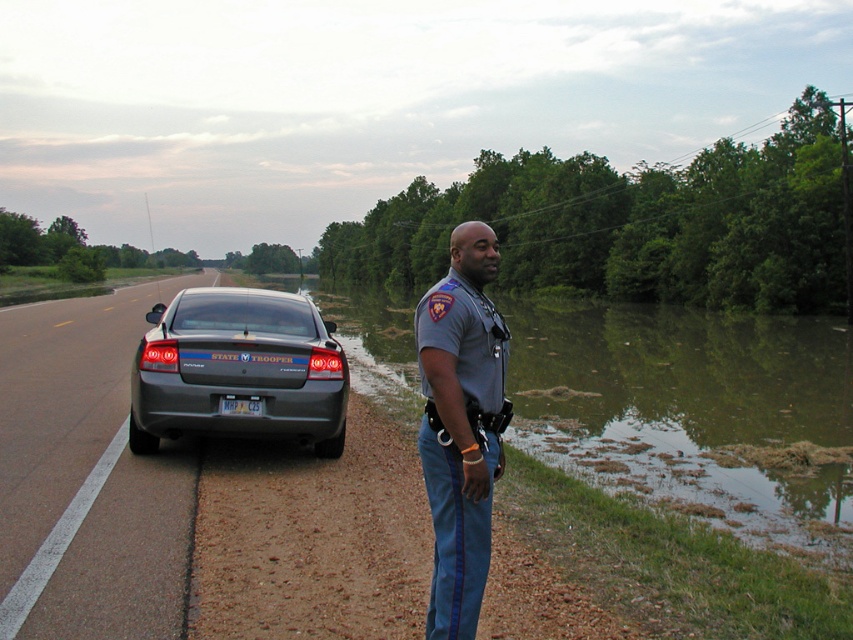
You are driving a car that is 2 meters wide and want to avoid the flooded area. The green muddy water at right is part of the flooded road. Can you safely drive around it on the left side of the road?

The green muddy water at right is 6.27 meters away from viewer. Since the flooded area is on the right side of the road, you can safely drive around it on the left side of the road as long as there is enough space. The car is 2 meters wide, and the road width isn

You are driving a car and see the satin gray sedan at center and the gray uniform at center in the scene. Which object is bigger in size?

The satin gray sedan at center is bigger in size compared to the gray uniform at center.